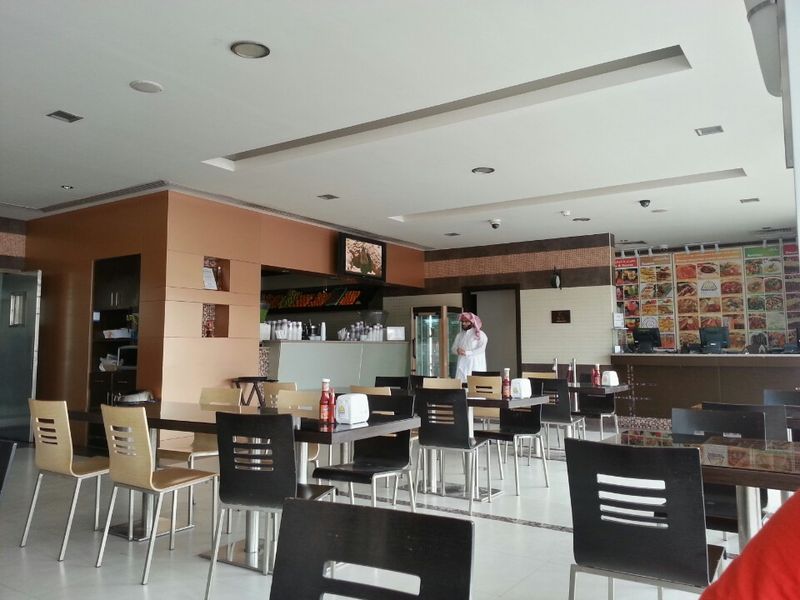
Where is `red wall`? This screenshot has height=600, width=800. red wall is located at coordinates (53, 237), (129, 231), (181, 238), (186, 343), (242, 355), (242, 300), (256, 242), (402, 258).